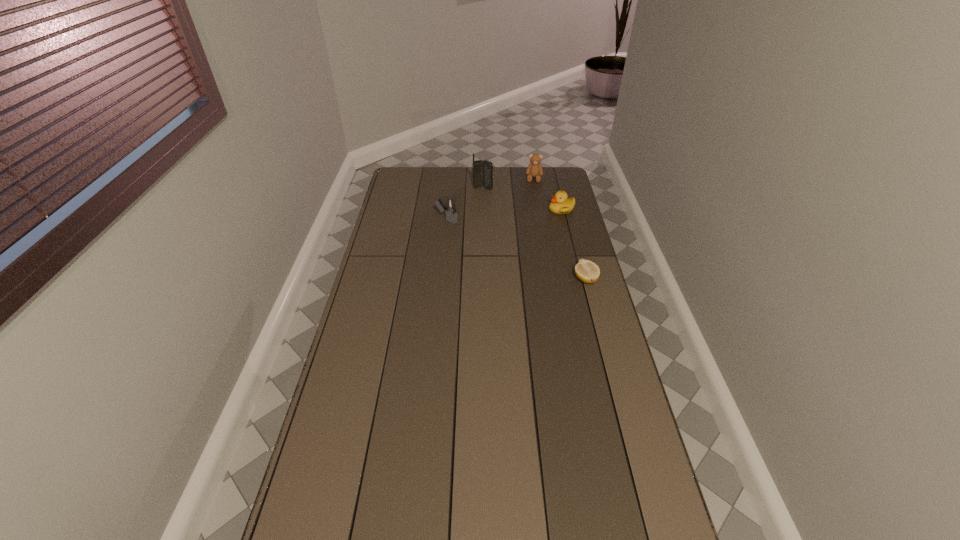
The width and height of the screenshot is (960, 540). Identify the location of free space on the desktop that is between the igniter and the lemon and is positioned on the keyboard of the tallest object. (522, 252).

Find the location of a particular element. Image resolution: width=960 pixels, height=540 pixels. vacant spot on the desktop that is between the leftmost object and the lemon and is positioned on the front-facing side of the fourth tallest object is located at coordinates (498, 241).

Find the location of a particular element. This screenshot has height=540, width=960. vacant spot on the desktop that is between the leftmost object and the shortest object and is positioned on the front-facing side of the farthest object is located at coordinates (528, 254).